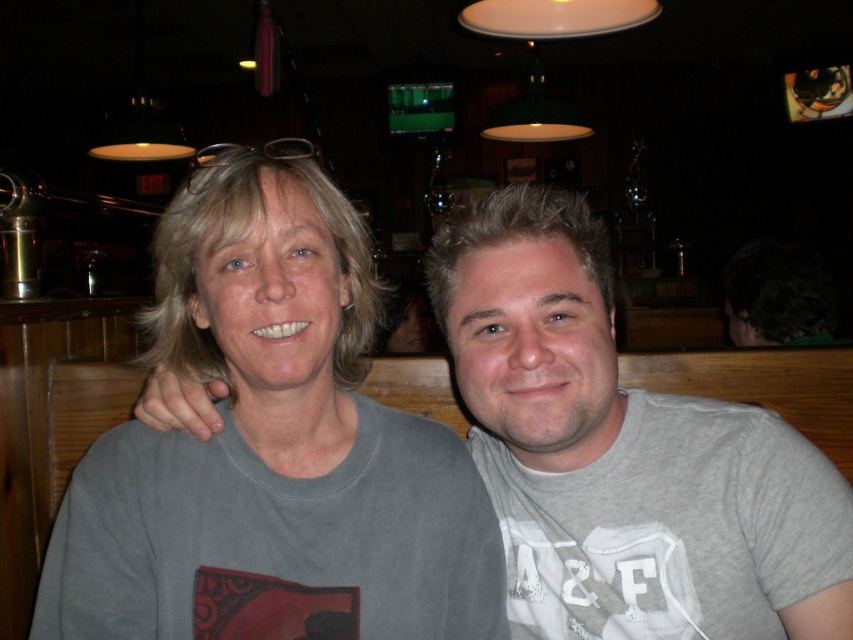
You are holding a smartphone and want to take a selfie with both people in the image. The optimal focus distance for your phone camera is 80 centimeters. Is the point at coordinates point (341, 401) within the focus range?

The distance of point (341, 401) from the camera is 83.10 centimeters, which is slightly beyond the optimal focus range of 80 centimeters. Therefore, the point is just outside the recommended focus distance.